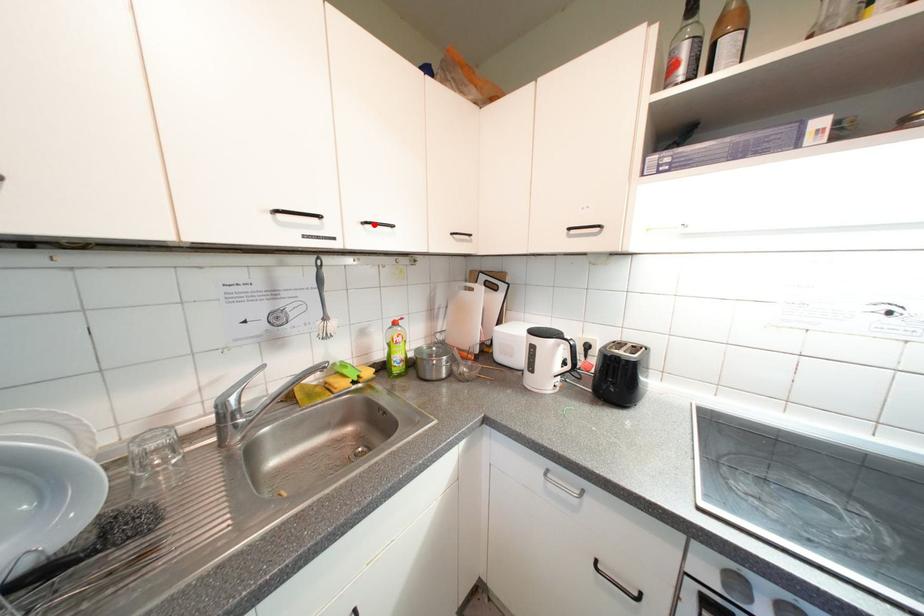
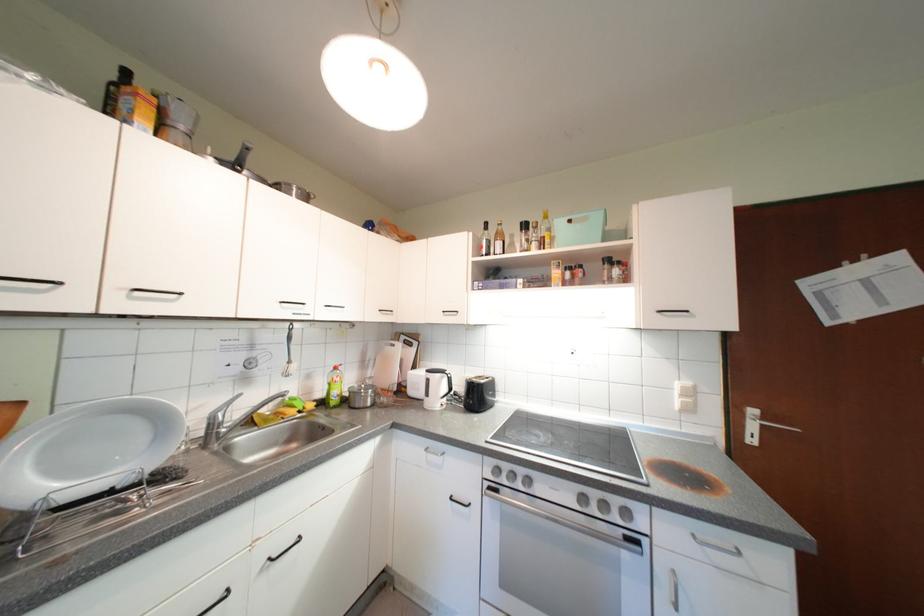
Locate, in the second image, the point that corresponds to the highlighted location in the first image.

(335, 309)